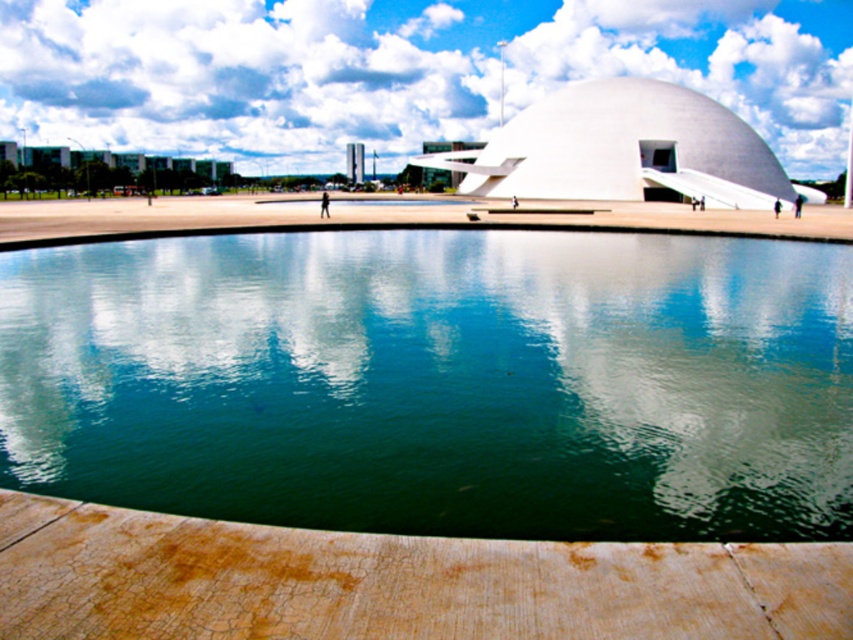
You are an architect designing a new building. You want to ensure that the reflection of the white smooth dome at center in the reflective pool is not obstructed by the shadow of the white cloud at upper center. Given their sizes, which object might cast a larger shadow on the pool?

The white cloud at upper center has a larger width than the white smooth dome at center, so it might cast a larger shadow on the pool.

You are an architect designing a new plaza and want to ensure the reflection of the white cloud at upper center and the white smooth dome at center in the central pool is accurate. Which object will appear to the left in the reflection?

The white cloud at upper center will appear to the left in the reflection because reflections mirror the original positions, so the white cloud at upper center, which is on the left of the white smooth dome at center in reality, will also be on the left in the reflection.

In the scene shown: You are an architect designing a new plaza and want to ensure that the green smooth water at center and the white smooth dome at center are visible from a distance. Which object will appear smaller when viewed from afar?

The green smooth water at center will appear smaller than the white smooth dome at center when viewed from afar because it is shorter in height.